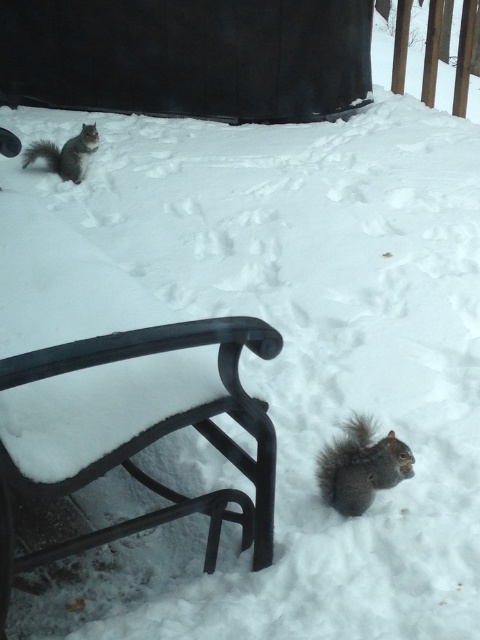
Which is more to the left, black metal bench at lower left or gray furry squirrel at upper left?

Positioned to the left is gray furry squirrel at upper left.

Based on the photo, can you confirm if black metal bench at lower left is positioned to the right of gray furry squirrel at upper left?

Indeed, black metal bench at lower left is positioned on the right side of gray furry squirrel at upper left.

Find the location of a particular element. This screenshot has height=640, width=480. black metal bench at lower left is located at coordinates (156, 440).

Identify the location of black metal bench at lower left. The image size is (480, 640). (156, 440).

Which is below, gray furry squirrel at lower right or gray furry squirrel at upper left?

Positioned lower is gray furry squirrel at lower right.

At what (x,y) coordinates should I click in order to perform the action: click on gray furry squirrel at lower right. Please return your answer as a coordinate pair (x, y). The width and height of the screenshot is (480, 640). Looking at the image, I should click on (360, 467).

Is the position of black metal bench at lower left less distant than that of gray furry squirrel at lower right?

Yes.

Is point (241, 547) farther from camera compared to point (356, 433)?

That is False.

I want to click on black metal bench at lower left, so click(156, 440).